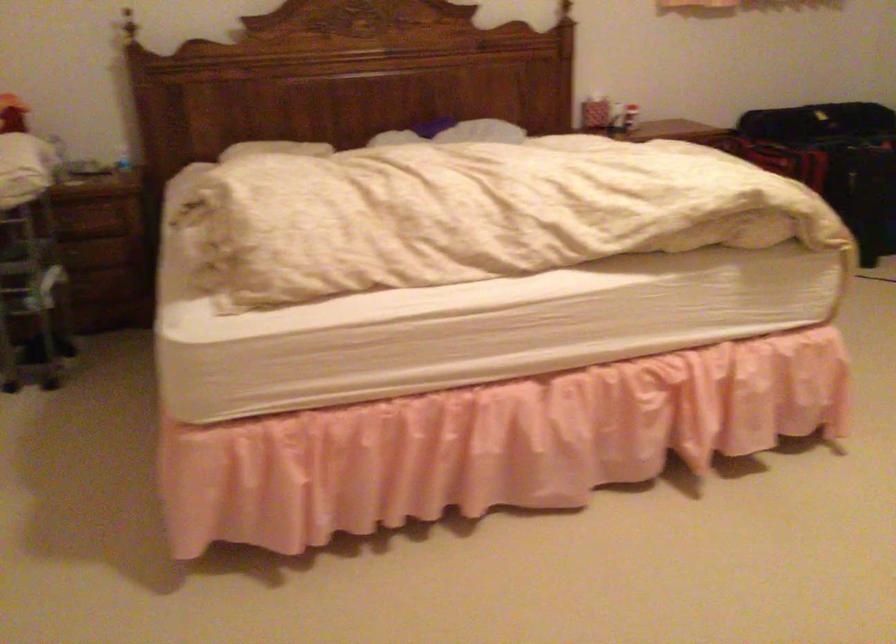
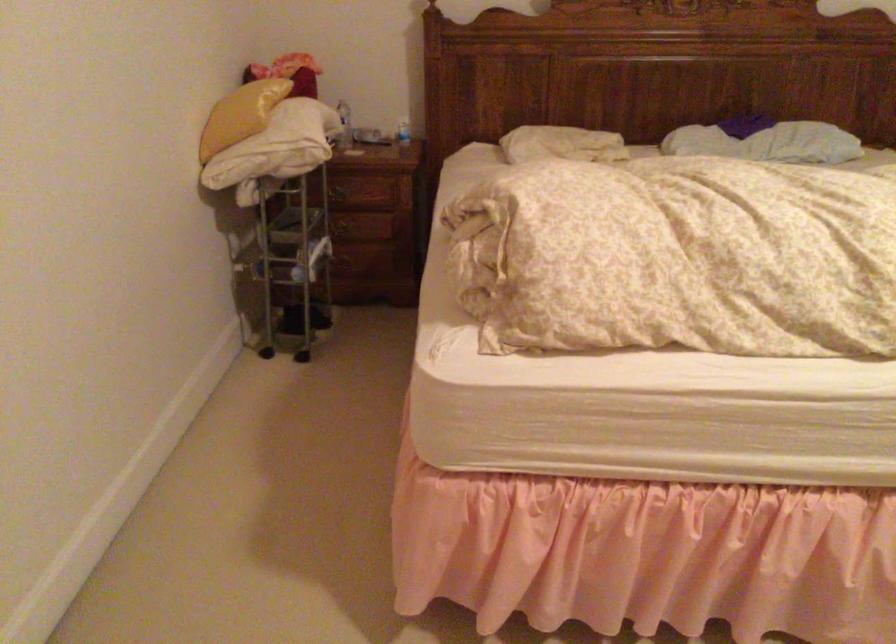
The point at (x=69, y=248) is marked in the first image. Where is the corresponding point in the second image?

(342, 230)